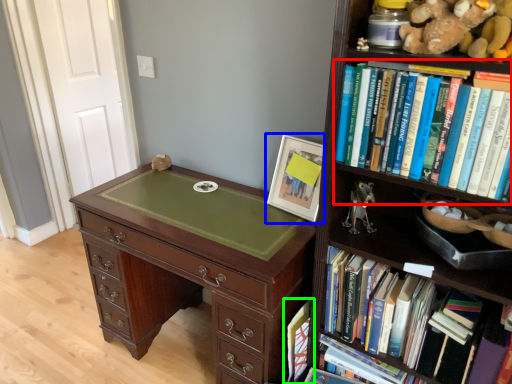
Question: Which object is positioned farthest from book (highlighted by a red box)? Select from picture frame (highlighted by a blue box) and book (highlighted by a green box).

Choices:
 (A) picture frame
 (B) book

Answer: (B)